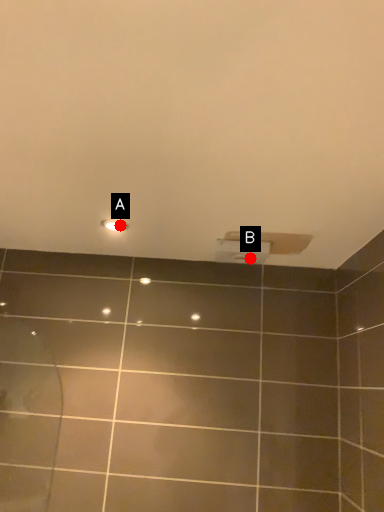
Question: Two points are circled on the image, labeled by A and B beside each circle. Which point is closer to the camera taking this photo?

Choices:
 (A) A is closer
 (B) B is closer

Answer: (A)